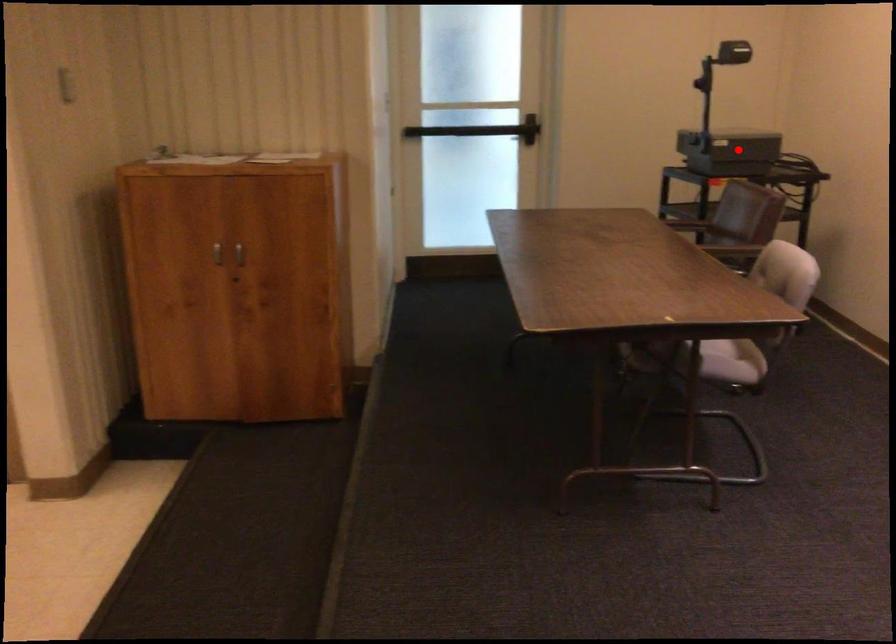
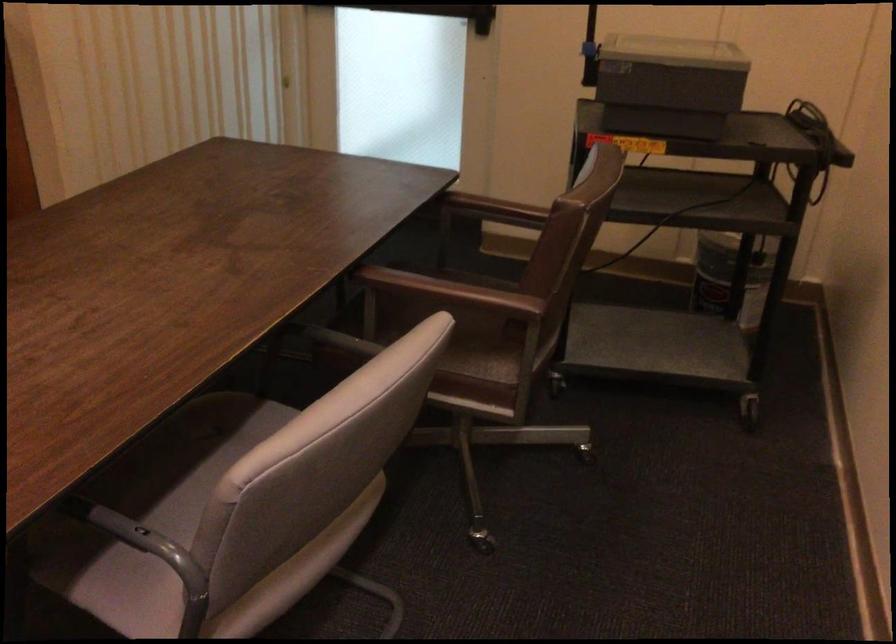
Locate, in the second image, the point that corresponds to the highlighted location in the first image.

(668, 84)